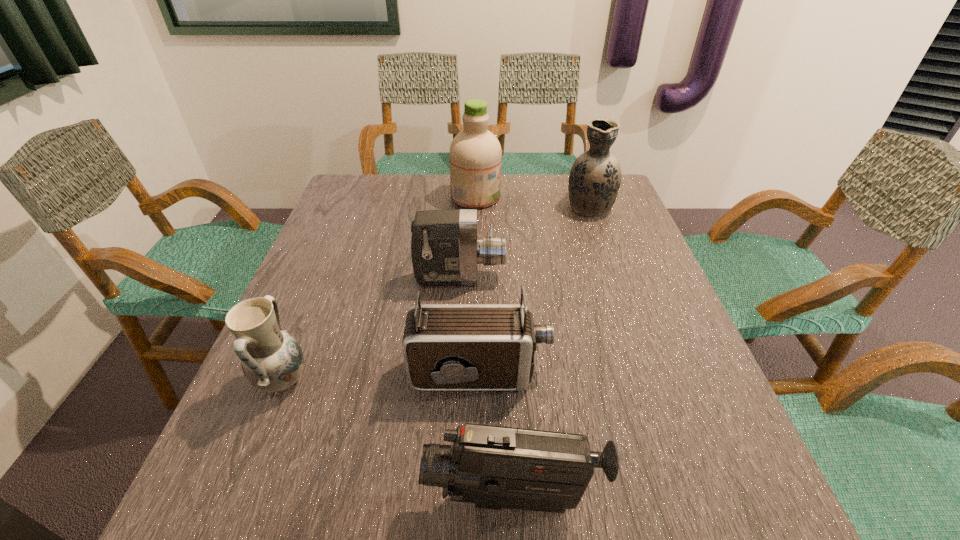
Find the location of `cleansing agent`. cleansing agent is located at coordinates click(x=475, y=153).

The image size is (960, 540). In order to click on vase in this screenshot , I will do `click(595, 177)`.

Where is `the second nearest camcorder`? the second nearest camcorder is located at coordinates (447, 347).

Identify the location of the leftmost object. (272, 360).

You are a GUI agent. You are given a task and a screenshot of the screen. Output one action in this format:
    pyautogui.click(x=<x>, y=<y>)
    Task: Click on the farthest camcorder
    The image size is (960, 540).
    Given the screenshot: What is the action you would take?
    pyautogui.click(x=445, y=250)

Find the location of a particular element. the nearest object is located at coordinates click(x=494, y=467).

At what (x,y) coordinates should I click in order to perform the action: click on free space located 0.370m on the front label of the cleansing agent. Please return your answer as a coordinate pair (x, y). This screenshot has height=540, width=960. Looking at the image, I should click on (620, 197).

Identify the location of vacant position located 0.300m at the lens of the second nearest camcorder. This screenshot has width=960, height=540. (703, 374).

The height and width of the screenshot is (540, 960). Identify the location of vacant space positioned 0.290m on either side of the pottery. (459, 381).

Where is `vacant region located 0.370m at the front of the farthest camcorder, highlighting the lens`? The width and height of the screenshot is (960, 540). vacant region located 0.370m at the front of the farthest camcorder, highlighting the lens is located at coordinates (656, 278).